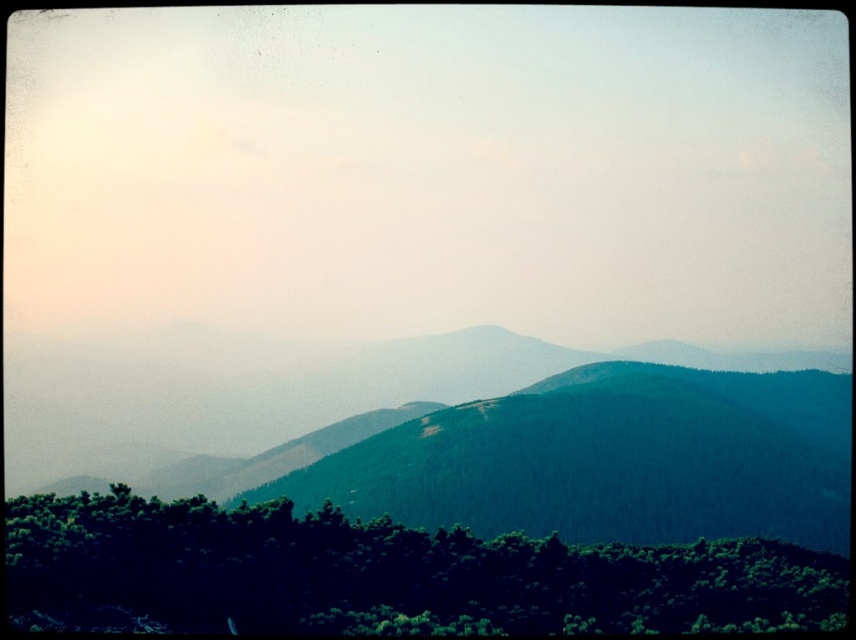
Question: Does green forested mountain at center have a lesser width compared to green leafy trees at lower center?

Choices:
 (A) yes
 (B) no

Answer: (B)

Question: Which point is closer to the camera?

Choices:
 (A) (685, 598)
 (B) (418, 412)

Answer: (A)

Question: Can you confirm if green forested mountain at center is positioned to the right of green leafy trees at lower center?

Choices:
 (A) no
 (B) yes

Answer: (A)

Question: Can you confirm if green forested mountain at center is bigger than green leafy trees at lower center?

Choices:
 (A) no
 (B) yes

Answer: (B)

Question: Which point is closer to the camera?

Choices:
 (A) green leafy trees at lower center
 (B) green forested mountain at center

Answer: (A)

Question: Which point is farther to the camera?

Choices:
 (A) green forested mountain at center
 (B) green leafy trees at lower center

Answer: (A)